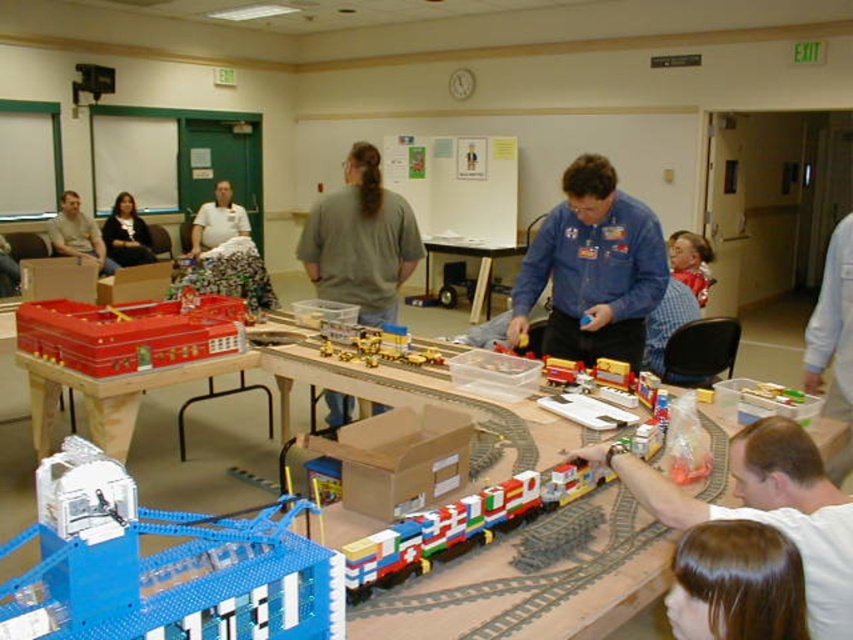
You are standing in the room and want to place a new train component between the matte plastic table at center and the metallic gold train at center. Based on their positions, which object should you start moving the component from to ensure it is placed correctly between them?

The matte plastic table at center is to the left of metallic gold train at center, so you should start moving the component from the matte plastic table at center towards the metallic gold train at center to place it correctly between them.